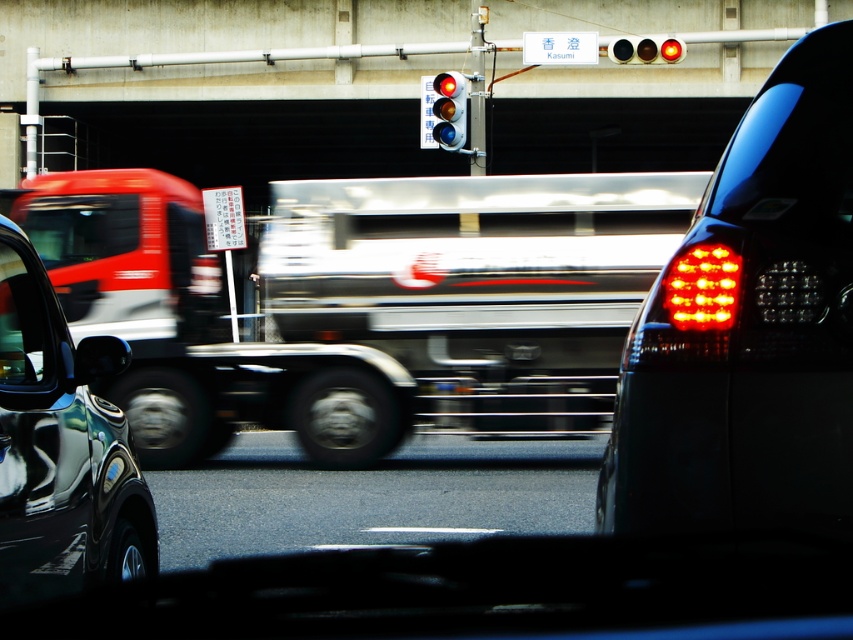
Question: Is asphalt at center thinner than matte glass traffic light at upper center?

Choices:
 (A) yes
 (B) no

Answer: (B)

Question: Based on their relative distances, which object is farther from the matte glass traffic light at upper center?

Choices:
 (A) shiny black car at left
 (B) asphalt at center

Answer: (A)

Question: Does shiny black car at left come behind matte glass traffic light at upper center?

Choices:
 (A) yes
 (B) no

Answer: (B)

Question: Estimate the real-world distances between objects in this image. Which object is closer to the asphalt at center?

Choices:
 (A) matte black car at right
 (B) red glass traffic light at upper center
 (C) matte glass traffic light at upper center

Answer: (A)

Question: Which of these objects is positioned farthest from the shiny black car at left?

Choices:
 (A) matte black car at right
 (B) matte glass traffic light at upper center
 (C) asphalt at center

Answer: (B)

Question: Is matte black car at right thinner than matte glass traffic light at upper center?

Choices:
 (A) no
 (B) yes

Answer: (A)